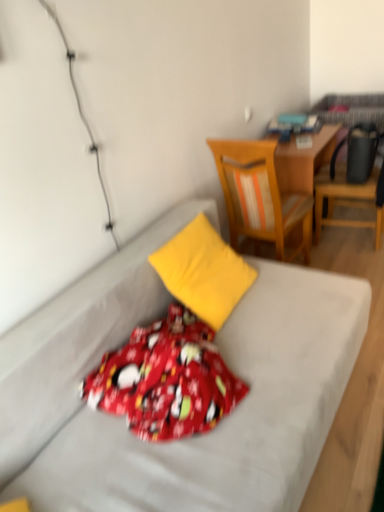
Question: Considering the positions of wooden chair at upper right, positioned as the first chair in right-to-left order, and yellow fabric bed at center in the image, is wooden chair at upper right, positioned as the first chair in right-to-left order, bigger or smaller than yellow fabric bed at center?

Choices:
 (A) big
 (B) small

Answer: (B)

Question: From their relative heights in the image, would you say wooden chair at upper right, positioned as the first chair in right-to-left order, is taller or shorter than yellow fabric bed at center?

Choices:
 (A) tall
 (B) short

Answer: (A)

Question: Based on their relative distances, which object is farther from the yellow fabric pillow at center?

Choices:
 (A) wooden desk at center
 (B) yellow fabric bed at center
 (C) wooden chair at upper right, positioned as the first chair in right-to-left order
 (D) red cotton blanket at center
 (E) wooden chair at upper right, which is the 1th chair in left-to-right order

Answer: (C)

Question: Which is nearer to the red cotton blanket at center?

Choices:
 (A) wooden desk at center
 (B) yellow fabric bed at center
 (C) wooden chair at upper right, which is the 1th chair in left-to-right order
 (D) yellow fabric pillow at center
 (E) wooden chair at upper right, positioned as the first chair in right-to-left order

Answer: (B)